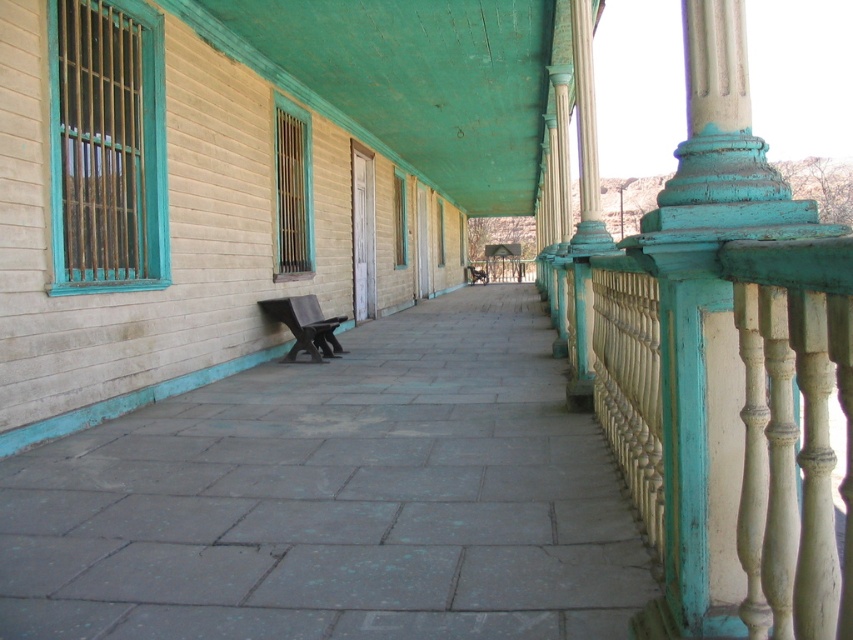
You are standing on the porch and want to place a small potted plant exactly at the center of the gray stone pavement at center. According to the image, where should you place the potted plant?

The gray stone pavement at center is located at the 2D coordinates point (337, 499), so you should place the potted plant at that exact point.

You are a delivery person trying to park a 2.5 meter wide delivery cart on the porch. The gray stone pavement at center and wooden park bench at center are both located in the middle of the porch. Which area should you choose to park your cart without exceeding its width?

The gray stone pavement at center has a larger width than the wooden park bench at center, so you should park the delivery cart on the gray stone pavement at center to ensure it fits within the available space.